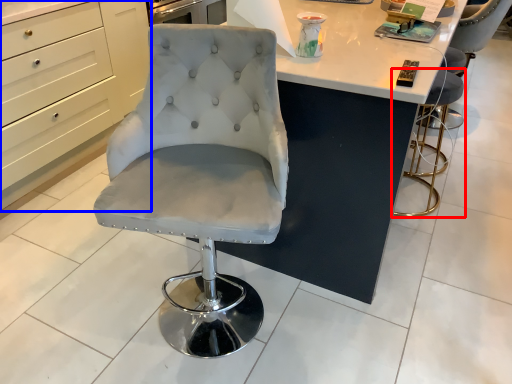
Question: Which point is closer to the camera, chair (highlighted by a red box) or cabinetry (highlighted by a blue box)?

Choices:
 (A) chair
 (B) cabinetry

Answer: (B)